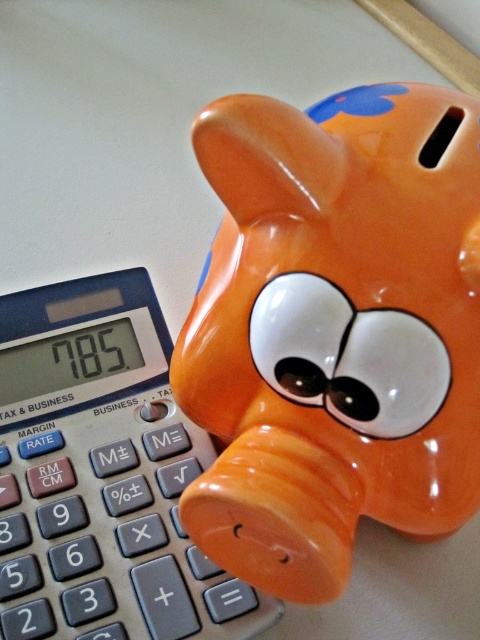
Who is more distant from viewer, [427,412] or [393,362]?

The point [427,412] is behind.

Describe the element at coordinates (335, 330) in the screenshot. Image resolution: width=480 pixels, height=640 pixels. I see `orange glossy piggy bank at upper right` at that location.

Find the location of a particular element. The image size is (480, 640). orange glossy piggy bank at upper right is located at coordinates (335, 330).

Who is lower down, orange glossy piggy bank at upper right or blue plastic calculator at center-left?

blue plastic calculator at center-left

Between orange glossy piggy bank at upper right and blue plastic calculator at center-left, which one has less height?

With less height is blue plastic calculator at center-left.

Image resolution: width=480 pixels, height=640 pixels. In order to click on orange glossy piggy bank at upper right in this screenshot , I will do `click(335, 330)`.

Is blue plastic calculator at center-left below white glossy eye at center?

Yes.

Describe the element at coordinates (101, 476) in the screenshot. I see `blue plastic calculator at center-left` at that location.

At what (x,y) coordinates should I click in order to perform the action: click on blue plastic calculator at center-left. Please return your answer as a coordinate pair (x, y). The height and width of the screenshot is (640, 480). Looking at the image, I should click on (101, 476).